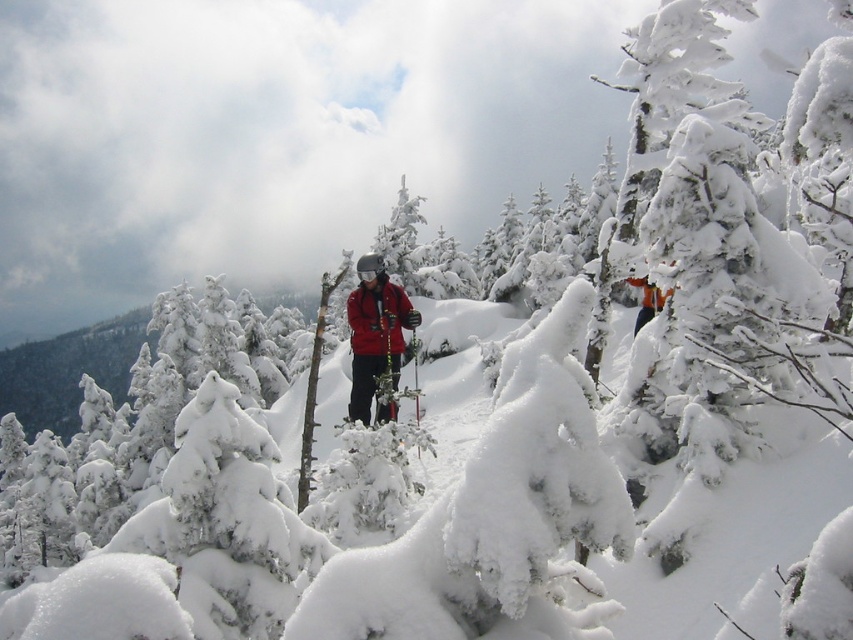
Question: Can you confirm if matte red jacket at center is smaller than orange ski jacket at center?

Choices:
 (A) yes
 (B) no

Answer: (B)

Question: Where is matte red jacket at center located in relation to orange ski jacket at center in the image?

Choices:
 (A) left
 (B) right

Answer: (A)

Question: Where is matte red jacket at center located in relation to orange ski jacket at center in the image?

Choices:
 (A) below
 (B) above

Answer: (A)

Question: Which of the following is the closest to the observer?

Choices:
 (A) matte red jacket at center
 (B) orange ski jacket at center

Answer: (A)

Question: Which point is closer to the camera?

Choices:
 (A) matte red jacket at center
 (B) orange ski jacket at center

Answer: (A)